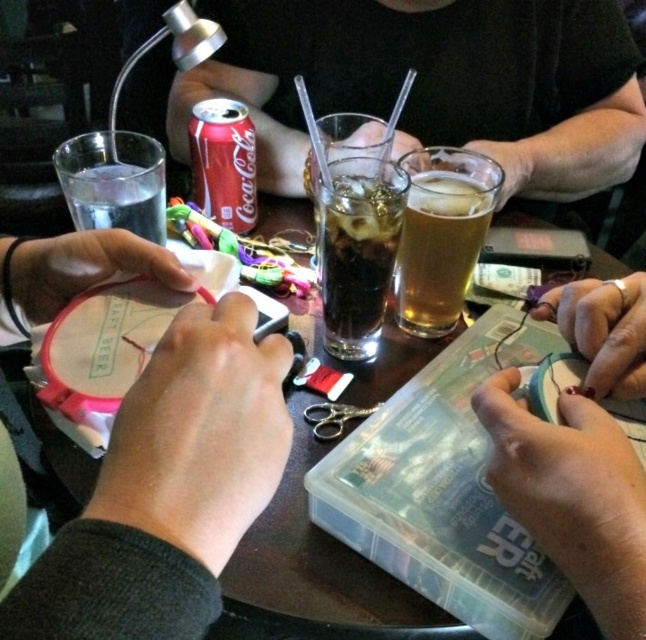
Is smooth black shirt at upper center shorter than translucent glass beer at center?

No.

Can you confirm if smooth black shirt at upper center is taller than translucent glass beer at center?

Yes.

Where is `smooth black shirt at upper center`? smooth black shirt at upper center is located at coordinates (437, 83).

At what (x,y) coordinates should I click in order to perform the action: click on smooth black shirt at upper center. Please return your answer as a coordinate pair (x, y). The height and width of the screenshot is (640, 646). Looking at the image, I should click on coord(437,83).

Is pink fabric hoop at center thinner than translucent glass beer at center?

Incorrect, pink fabric hoop at center's width is not less than translucent glass beer at center's.

This screenshot has height=640, width=646. Describe the element at coordinates (169, 490) in the screenshot. I see `pink fabric hoop at center` at that location.

What are the coordinates of `pink fabric hoop at center` in the screenshot? It's located at (169, 490).

Is point (14, 515) less distant than point (160, 208)?

Yes, point (14, 515) is closer to viewer.

Does pink fabric hoop at center have a lesser height compared to clear glass water at left?

No.

Is point (120, 600) positioned in front of point (158, 198)?

That is True.

Identify the location of pink fabric hoop at center. The height and width of the screenshot is (640, 646). (169, 490).